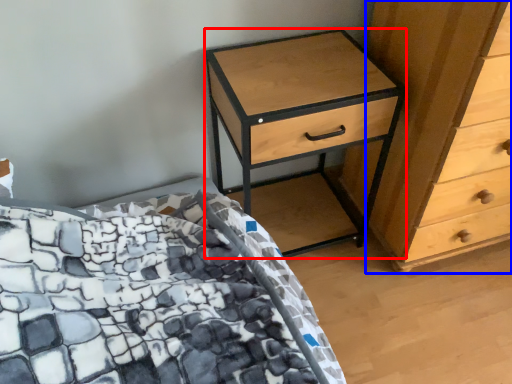
Question: Among these objects, which one is farthest to the camera, nightstand (highlighted by a red box) or chest of drawers (highlighted by a blue box)?

Choices:
 (A) nightstand
 (B) chest of drawers

Answer: (A)